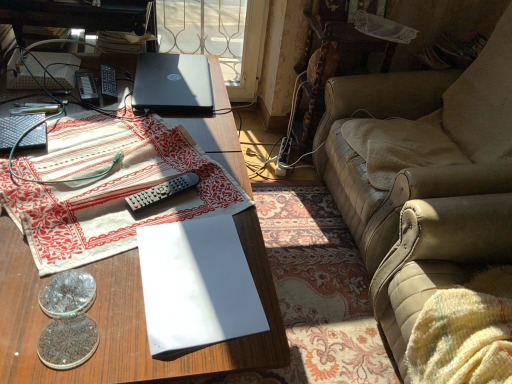
Where is `vacant space underneath white cotton tablecloth at left (from a real-world perspective)`? vacant space underneath white cotton tablecloth at left (from a real-world perspective) is located at coordinates (93, 153).